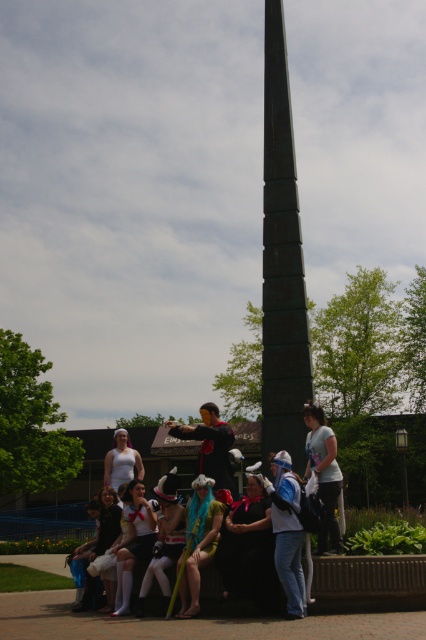
You are a photographer trying to capture a photo of both the smooth black cape at center and the black fabric dress at lower left. Since you want both subjects to be fully visible in the frame, which object should you focus on first to ensure they are both in the shot?

The smooth black cape at center is taller than the black fabric dress at lower left, so you should focus on the smooth black cape at center first to ensure both are fully visible in the frame.

You are a photographer at the event and want to ensure both the matte white shirt at center and the white matte cosplay outfit at center are visible in your photo. Given their sizes, which one might you need to adjust your camera angle to include fully?

The white matte cosplay outfit at center is larger than the matte white shirt at center, so you might need to adjust your camera angle to include the larger white matte cosplay outfit at center fully.